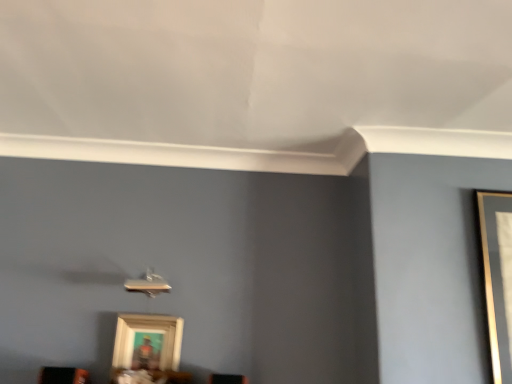
Question: From the image's perspective, relative to wooden framed picture at lower center, is matte black speaker at lower left above or below?

Choices:
 (A) above
 (B) below

Answer: (B)

Question: Is matte black speaker at lower left in front of or behind wooden framed picture at lower center in the image?

Choices:
 (A) front
 (B) behind

Answer: (A)

Question: Is matte black speaker at lower left taller or shorter than wooden framed picture at lower center?

Choices:
 (A) short
 (B) tall

Answer: (A)

Question: From a real-world perspective, relative to matte black speaker at lower left, is wooden framed picture at lower center vertically above or below?

Choices:
 (A) above
 (B) below

Answer: (A)

Question: Based on their positions, is wooden framed picture at lower center located to the left or right of matte black speaker at lower left?

Choices:
 (A) left
 (B) right

Answer: (B)

Question: Do you think wooden framed picture at lower center is within matte black speaker at lower left, or outside of it?

Choices:
 (A) inside
 (B) outside

Answer: (B)

Question: Looking at their shapes, would you say wooden framed picture at lower center is wider or thinner than matte black speaker at lower left?

Choices:
 (A) wide
 (B) thin

Answer: (B)